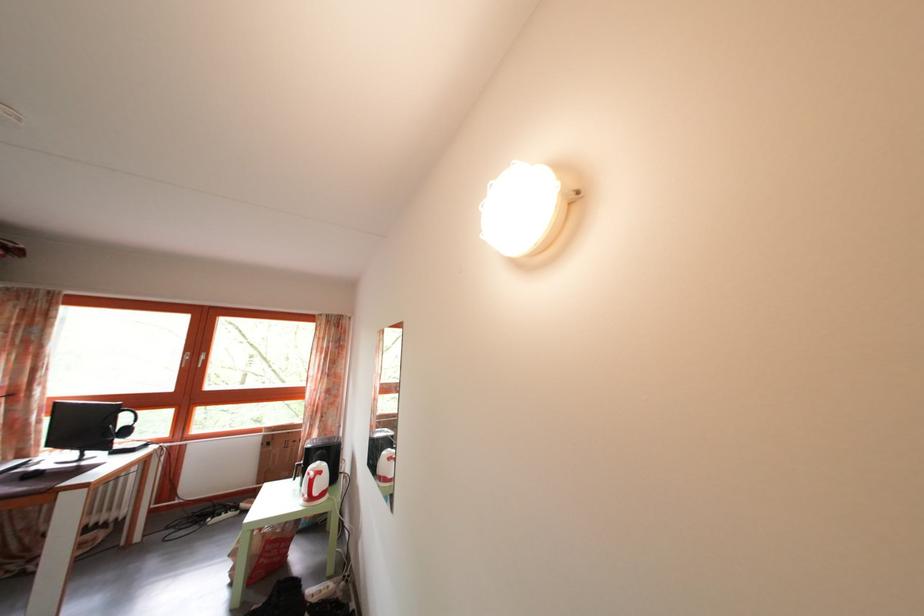
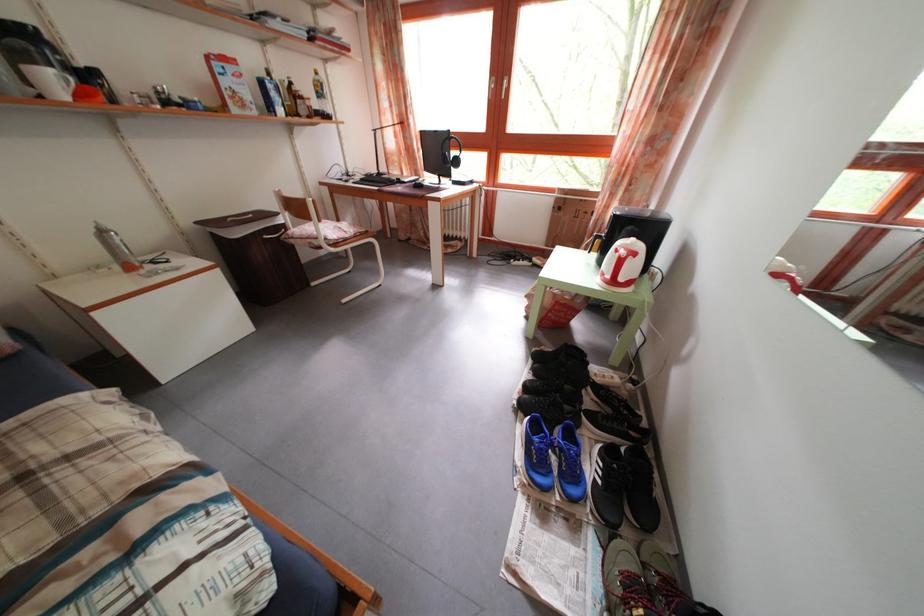
Find the pixel in the second image that matches [327,480] in the first image.

(641, 262)